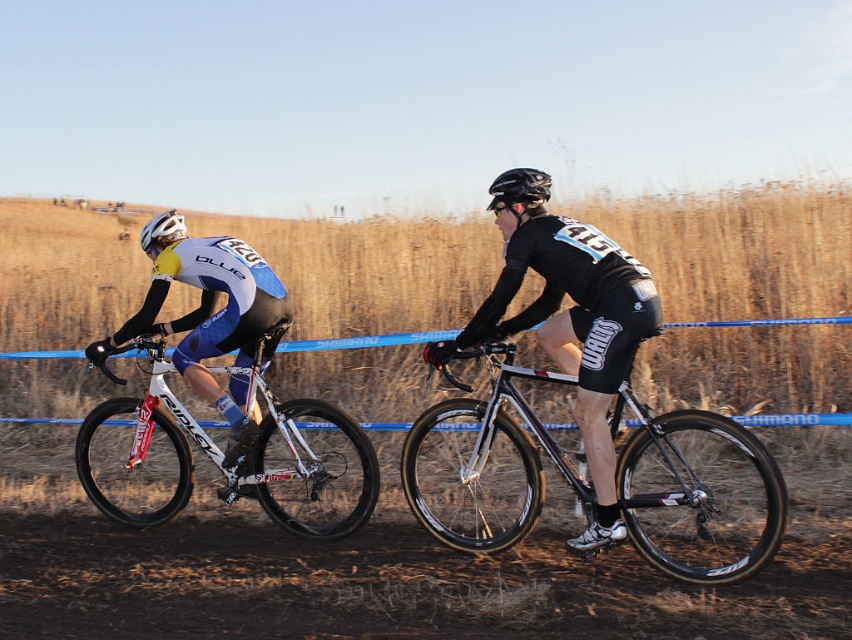
You are a spectator at the cyclocross race and want to take a photo of both the shiny black frame at center and the white glossy bicycle at left. Based on their positions, which bicycle should be placed on the right side in your photo?

The shiny black frame at center should be placed on the right side of the white glossy bicycle at left in your photo because it is positioned on the right side of the white glossy bicycle at left according to the description.

Based on the photo, you are a spectator at the cyclocross race and want to compare the bicycles of the two cyclists. Which bicycle has a shorter frame, the shiny black frame at center or the white glossy bicycle at left?

The shiny black frame at center is shorter than the white glossy bicycle at left, so the shiny black frame at center has a shorter frame.